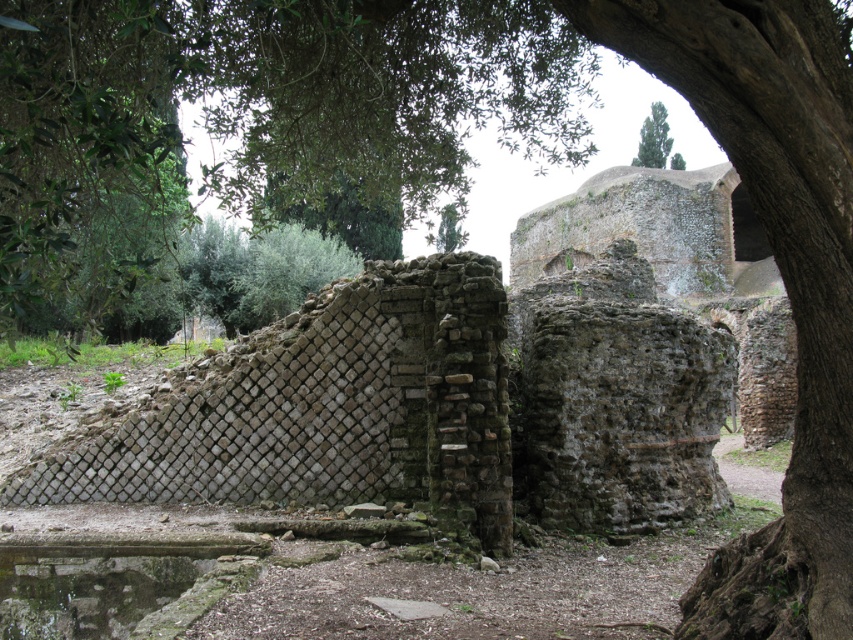
Between green leafy tree at upper left and green leafy tree at upper center, which one appears on the left side from the viewer's perspective?

green leafy tree at upper left is more to the left.

Can you confirm if green leafy tree at upper left is wider than green leafy tree at upper center?

Yes, green leafy tree at upper left is wider than green leafy tree at upper center.

Is point (386, 108) closer to viewer compared to point (640, 132)?

Yes, it is.

Identify the location of green leafy tree at upper left. (260, 113).

Between green mossy stone at lower left and green leafy tree at upper center, which one appears on the right side from the viewer's perspective?

From the viewer's perspective, green leafy tree at upper center appears more on the right side.

Can you confirm if green mossy stone at lower left is thinner than green leafy tree at upper center?

Yes.

What do you see at coordinates (109, 582) in the screenshot? I see `green mossy stone at lower left` at bounding box center [109, 582].

Identify the location of green mossy stone at lower left. This screenshot has width=853, height=640. (109, 582).

Between green leafy tree at upper left and green mossy stone at lower left, which one appears on the left side from the viewer's perspective?

green leafy tree at upper left is more to the left.

Is green leafy tree at upper left smaller than green mossy stone at lower left?

No, green leafy tree at upper left is not smaller than green mossy stone at lower left.

The width and height of the screenshot is (853, 640). What are the coordinates of `green leafy tree at upper left` in the screenshot? It's located at (260, 113).